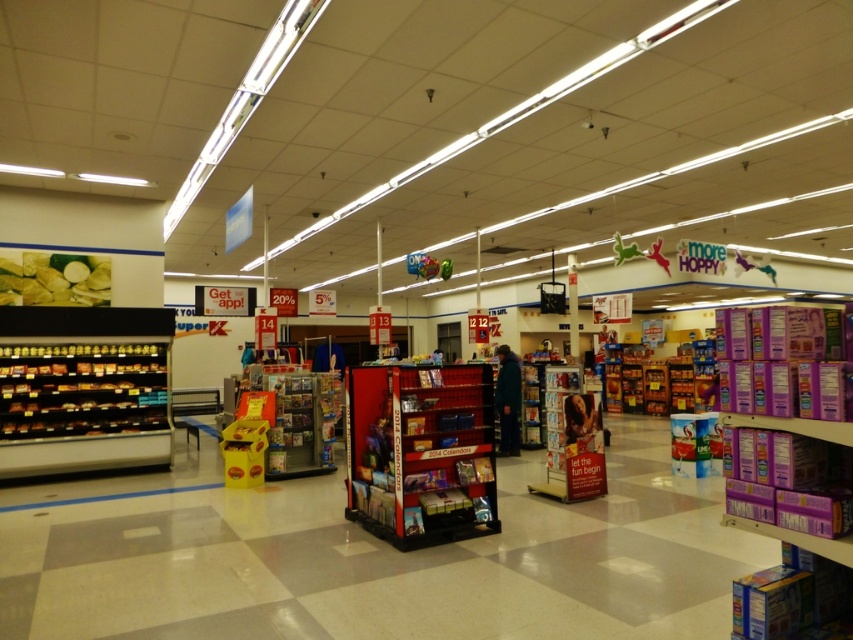
In the scene shown: Which is more to the left, metallic red display rack at center or dark blue jacket at center?

metallic red display rack at center is more to the left.

Between point (428, 531) and point (508, 428), which one is positioned in front?

Positioned in front is point (428, 531).

Locate an element on the screen. The height and width of the screenshot is (640, 853). metallic red display rack at center is located at coordinates (421, 452).

Is matte plastic magazine rack at center taller than metallic silver calendar at center?

No, matte plastic magazine rack at center is not taller than metallic silver calendar at center.

You are a GUI agent. You are given a task and a screenshot of the screen. Output one action in this format:
    pyautogui.click(x=<x>, y=<y>)
    Task: Click on the matte plastic magazine rack at center
    
    Given the screenshot: What is the action you would take?
    pyautogui.click(x=291, y=417)

Between metallic silver shelves at left and metallic silver calendar at center, which one is positioned higher?

metallic silver shelves at left is higher up.

Does metallic silver shelves at left have a larger size compared to metallic silver calendar at center?

Indeed, metallic silver shelves at left has a larger size compared to metallic silver calendar at center.

At what (x,y) coordinates should I click in order to perform the action: click on metallic silver shelves at left. Please return your answer as a coordinate pair (x, y). Looking at the image, I should click on (83, 388).

I want to click on metallic silver shelves at left, so click(x=83, y=388).